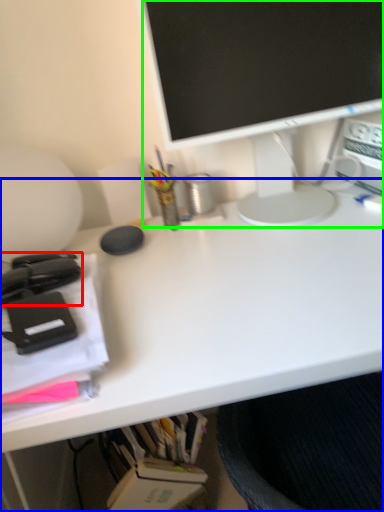
Question: Considering the real-world distances, which object is farthest from office supplies (highlighted by a red box)? desk (highlighted by a blue box) or television (highlighted by a green box)?

Choices:
 (A) desk
 (B) television

Answer: (B)